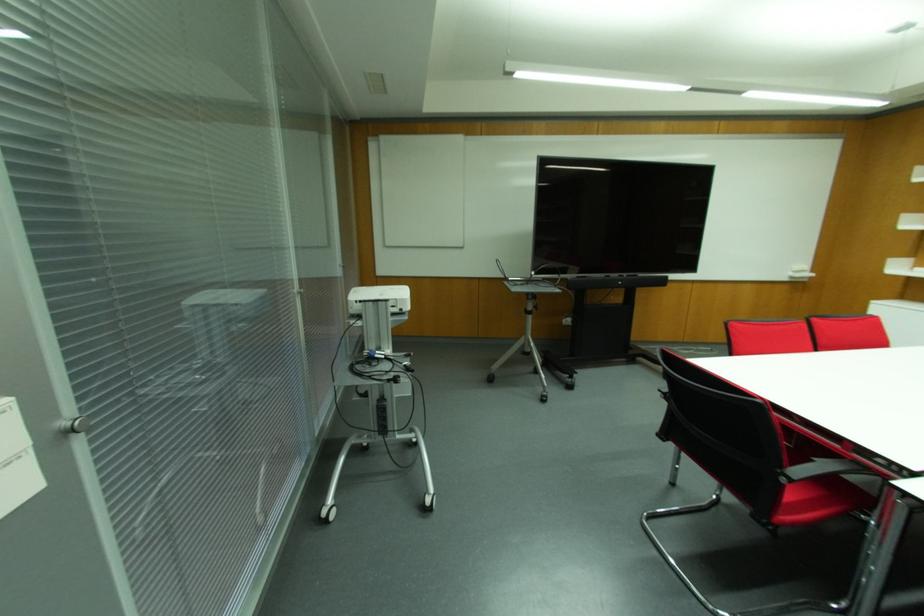
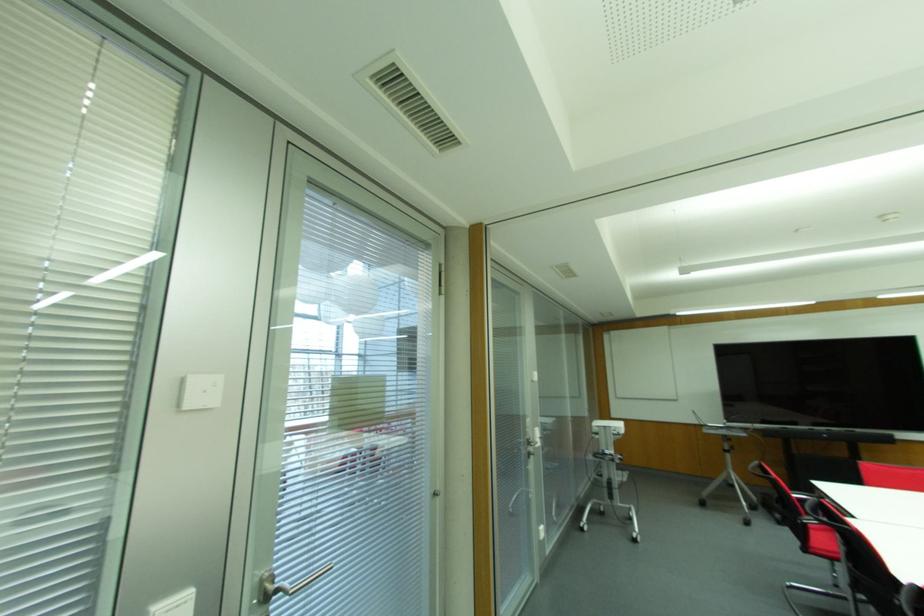
Where in the second image is the point corresponding to (323,521) from the first image?

(581, 529)